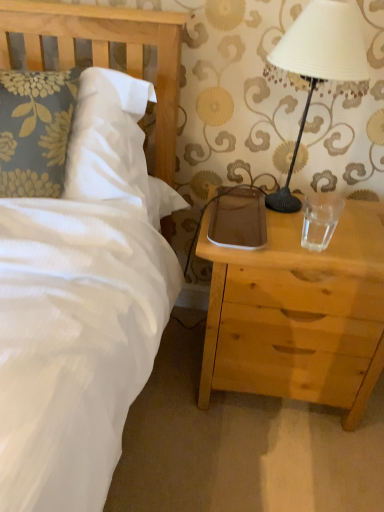
You are a GUI agent. You are given a task and a screenshot of the screen. Output one action in this format:
    pyautogui.click(x=<x>, y=<y>)
    Task: Click on the vacant location below white matte lampshade at upper right (from a real-world perspective)
    The width and height of the screenshot is (384, 512).
    Given the screenshot: What is the action you would take?
    pyautogui.click(x=301, y=210)